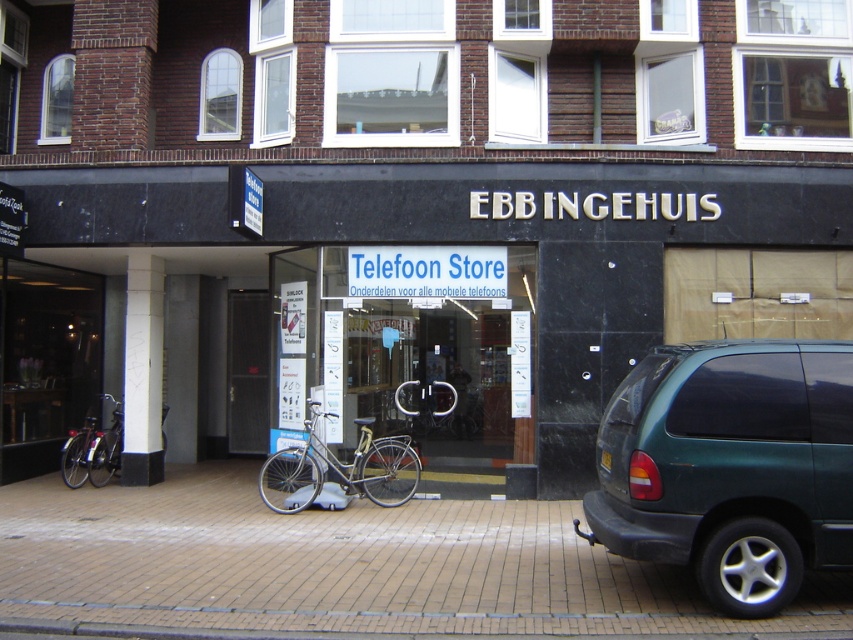
Question: Is green matte suv at right thinner than shiny metallic bicycle at left?

Choices:
 (A) yes
 (B) no

Answer: (B)

Question: Can you confirm if green matte suv at right is wider than silver metallic bicycle at center?

Choices:
 (A) yes
 (B) no

Answer: (B)

Question: Which of these objects is positioned farthest from the shiny metallic bicycle at left?

Choices:
 (A) green matte suv at right
 (B) black glass storefront at center

Answer: (A)

Question: Which point is closer to the camera?

Choices:
 (A) silver metallic bicycle at center
 (B) black glass storefront at center
 (C) shiny metallic bicycle at left

Answer: (B)

Question: Which point is farther from the camera taking this photo?

Choices:
 (A) (753, 602)
 (B) (91, 442)

Answer: (B)

Question: Can you confirm if black glass storefront at center is positioned below shiny metallic bicycle at left?

Choices:
 (A) no
 (B) yes

Answer: (A)